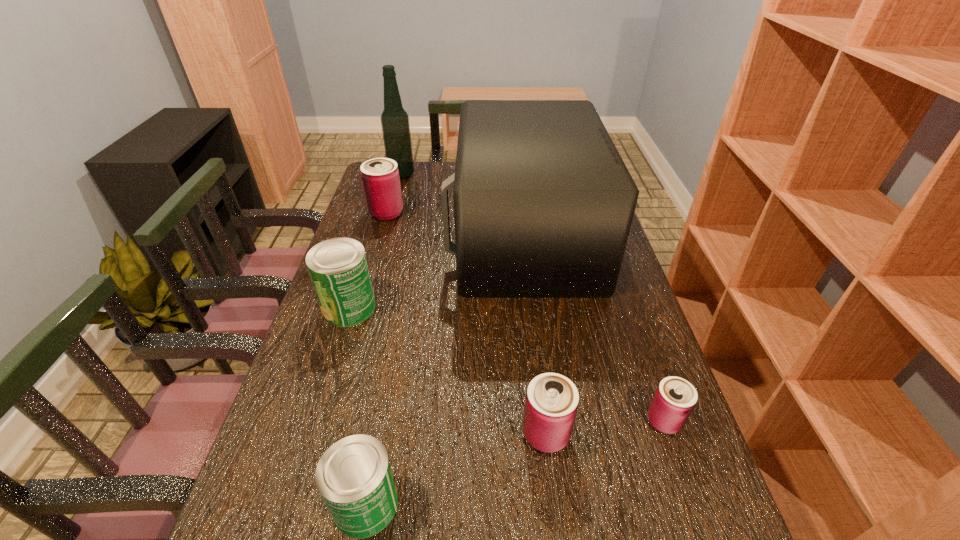
Identify the location of free region located 0.260m on the back of the nearest object. (393, 364).

This screenshot has width=960, height=540. In order to click on vacant space located on the back of the shortest can in this screenshot , I will do `click(628, 316)`.

Find the location of `alcohol present at the far edge`. alcohol present at the far edge is located at coordinates (395, 125).

Locate an element on the screen. microwave oven that is at the far edge is located at coordinates (543, 203).

Locate an element on the screen. alcohol at the left edge is located at coordinates (395, 125).

This screenshot has width=960, height=540. Find the location of `microwave oven that is positioned at the right edge`. microwave oven that is positioned at the right edge is located at coordinates (543, 203).

The image size is (960, 540). I want to click on can that is at the right edge, so click(675, 398).

At what (x,y) coordinates should I click in order to perform the action: click on object present at the far left corner. Please return your answer as a coordinate pair (x, y). The width and height of the screenshot is (960, 540). Looking at the image, I should click on (395, 125).

Image resolution: width=960 pixels, height=540 pixels. What are the coordinates of `object present at the far right corner` in the screenshot? It's located at (543, 203).

At what (x,y) coordinates should I click in order to perform the action: click on vacant space at the far edge of the desktop. Please return your answer as a coordinate pair (x, y). Image resolution: width=960 pixels, height=540 pixels. Looking at the image, I should click on (414, 180).